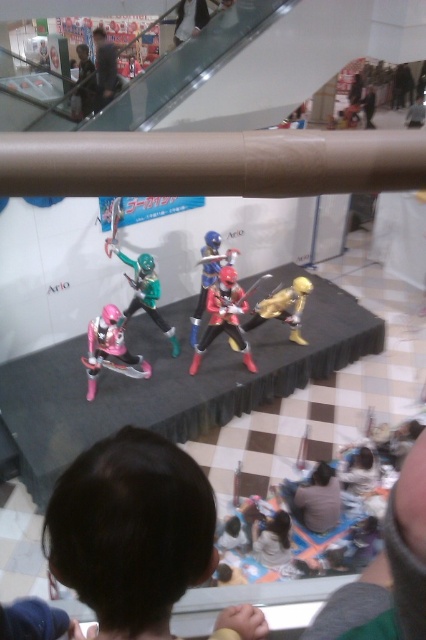
Which is in front, point (106, 337) or point (89, 106)?

Point (106, 337) is in front.

In the scene shown: Between pink matte action figure at center and green fabric figure at upper center, which one has less height?

With less height is green fabric figure at upper center.

You are a GUI agent. You are given a task and a screenshot of the screen. Output one action in this format:
    pyautogui.click(x=<x>, y=<y>)
    Task: Click on the pink matte action figure at center
    The image size is (426, 640).
    Given the screenshot: What is the action you would take?
    pyautogui.click(x=111, y=349)

Image resolution: width=426 pixels, height=640 pixels. Find the location of `pink matte action figure at center`. pink matte action figure at center is located at coordinates (111, 349).

Is gold metallic figure at center to the right of light brown leather shoes at upper center from the viewer's perspective?

Indeed, gold metallic figure at center is positioned on the right side of light brown leather shoes at upper center.

What do you see at coordinates (282, 307) in the screenshot? This screenshot has height=640, width=426. I see `gold metallic figure at center` at bounding box center [282, 307].

Which is in front, point (299, 300) or point (196, 6)?

Point (299, 300) is more forward.

This screenshot has width=426, height=640. Identify the location of gold metallic figure at center. (282, 307).

Is pink matte action figure at center wider than dark blue fabric jacket at upper center?

Yes.

Looking at this image, between pink matte action figure at center and dark blue fabric jacket at upper center, which one appears on the right side from the viewer's perspective?

From the viewer's perspective, pink matte action figure at center appears more on the right side.

Identify the location of pink matte action figure at center. This screenshot has height=640, width=426. (111, 349).

Find the location of a particular element. pink matte action figure at center is located at coordinates (111, 349).